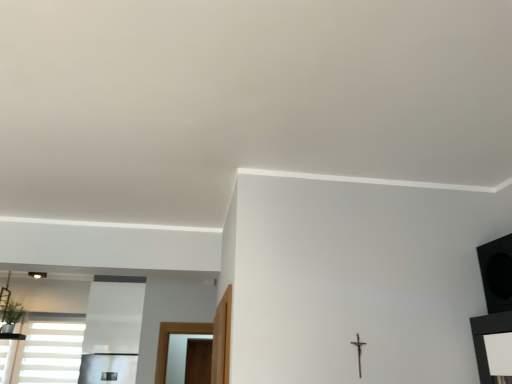
Question: Is green leafy plant at lower left with metallic crucifix at center-right?

Choices:
 (A) yes
 (B) no

Answer: (B)

Question: Considering the relative sizes of green leafy plant at lower left and metallic crucifix at center-right in the image provided, is green leafy plant at lower left thinner than metallic crucifix at center-right?

Choices:
 (A) no
 (B) yes

Answer: (A)

Question: From the image's perspective, is green leafy plant at lower left below metallic crucifix at center-right?

Choices:
 (A) yes
 (B) no

Answer: (A)

Question: Is the depth of green leafy plant at lower left less than that of metallic crucifix at center-right?

Choices:
 (A) yes
 (B) no

Answer: (B)

Question: From a real-world perspective, is green leafy plant at lower left below metallic crucifix at center-right?

Choices:
 (A) no
 (B) yes

Answer: (A)

Question: From the image's perspective, is green leafy plant at lower left above or below metallic crucifix at center-right?

Choices:
 (A) below
 (B) above

Answer: (A)

Question: Is green leafy plant at lower left situated inside metallic crucifix at center-right or outside?

Choices:
 (A) outside
 (B) inside

Answer: (A)

Question: Is point (12, 309) closer or farther from the camera than point (357, 337)?

Choices:
 (A) farther
 (B) closer

Answer: (A)

Question: Is green leafy plant at lower left to the left or to the right of metallic crucifix at center-right in the image?

Choices:
 (A) left
 (B) right

Answer: (A)

Question: Is metallic crucifix at center-right in front of or behind white matte window at lower left in the image?

Choices:
 (A) front
 (B) behind

Answer: (A)

Question: Is metallic crucifix at center-right wider or thinner than white matte window at lower left?

Choices:
 (A) wide
 (B) thin

Answer: (B)

Question: From the image's perspective, is metallic crucifix at center-right positioned above or below white matte window at lower left?

Choices:
 (A) below
 (B) above

Answer: (B)

Question: In terms of height, does metallic crucifix at center-right look taller or shorter compared to white matte window at lower left?

Choices:
 (A) tall
 (B) short

Answer: (B)

Question: Is green leafy plant at lower left bigger or smaller than white matte window at lower left?

Choices:
 (A) big
 (B) small

Answer: (B)

Question: In terms of height, does green leafy plant at lower left look taller or shorter compared to white matte window at lower left?

Choices:
 (A) tall
 (B) short

Answer: (B)